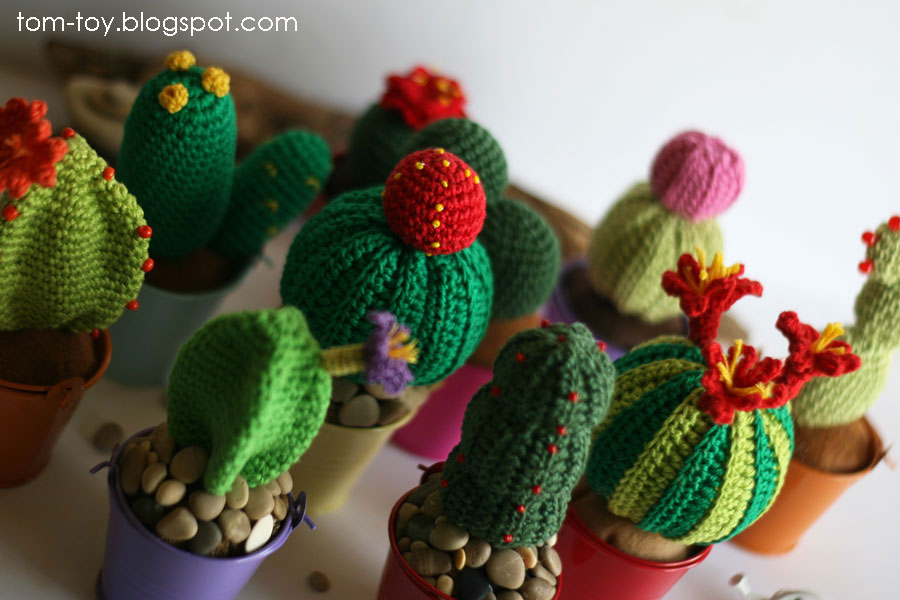
Where is `light blue pot`? light blue pot is located at coordinates (171, 341).